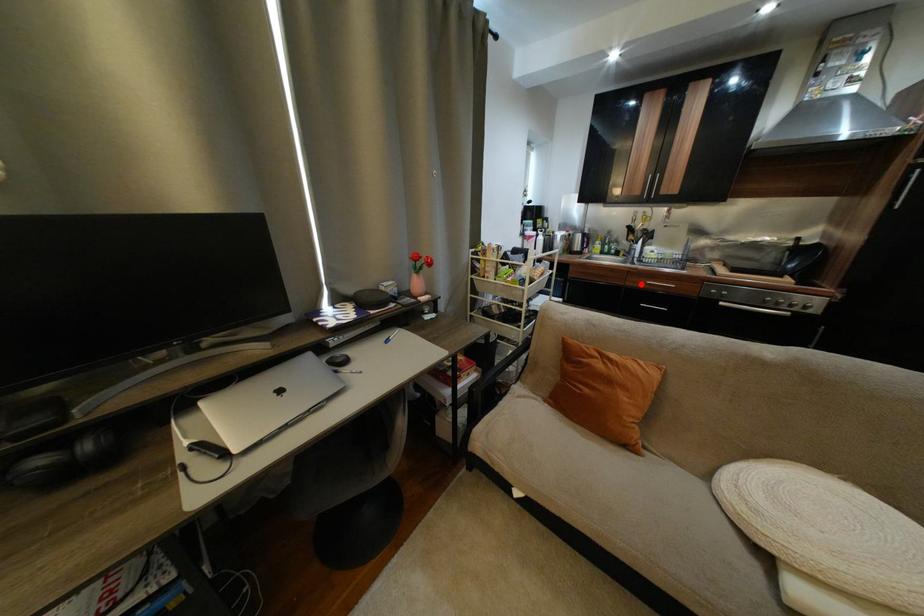
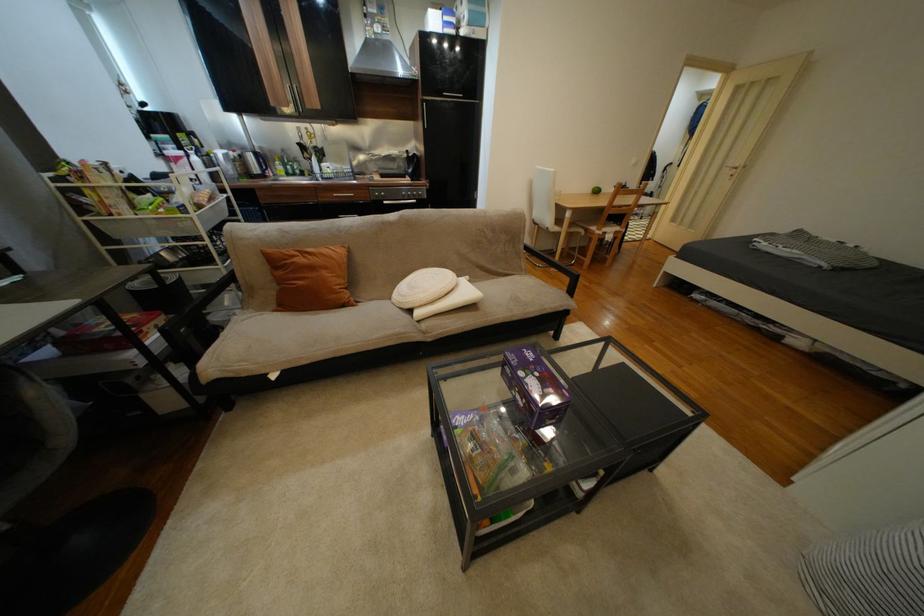
Question: A red point is marked in image1. In image2, is the corresponding 3D point closer to the camera or farther? Reply with the corresponding letter.

Choices:
 (A) The corresponding 3D point is closer.
 (B) The corresponding 3D point is farther.

Answer: (A)